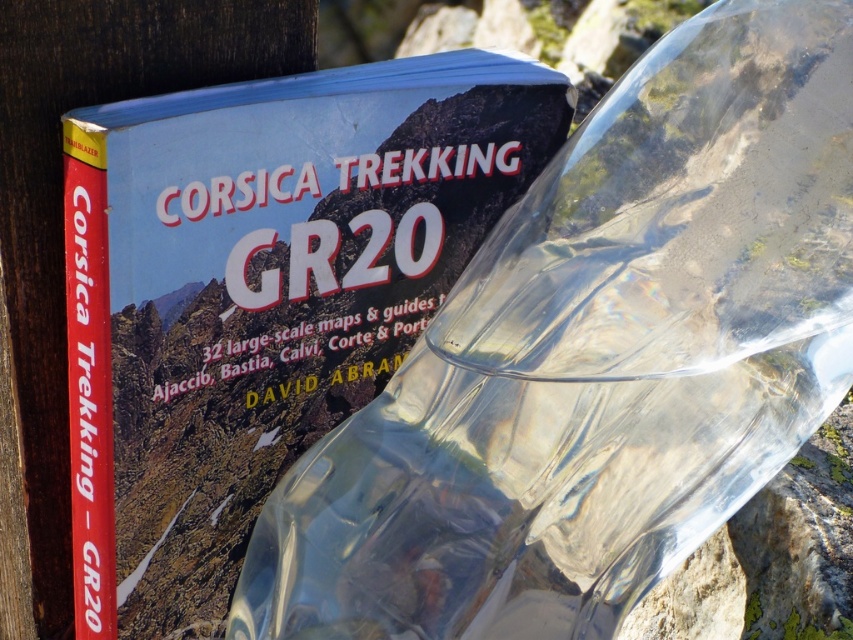
You are holding the matte paper book at center and want to place the transparent plastic bottle at center on the table next to it. Which side of the book should you place the bottle to ensure it is positioned correctly according to the image?

The transparent plastic bottle at center should be placed to the right of the matte paper book at center as shown in the image.